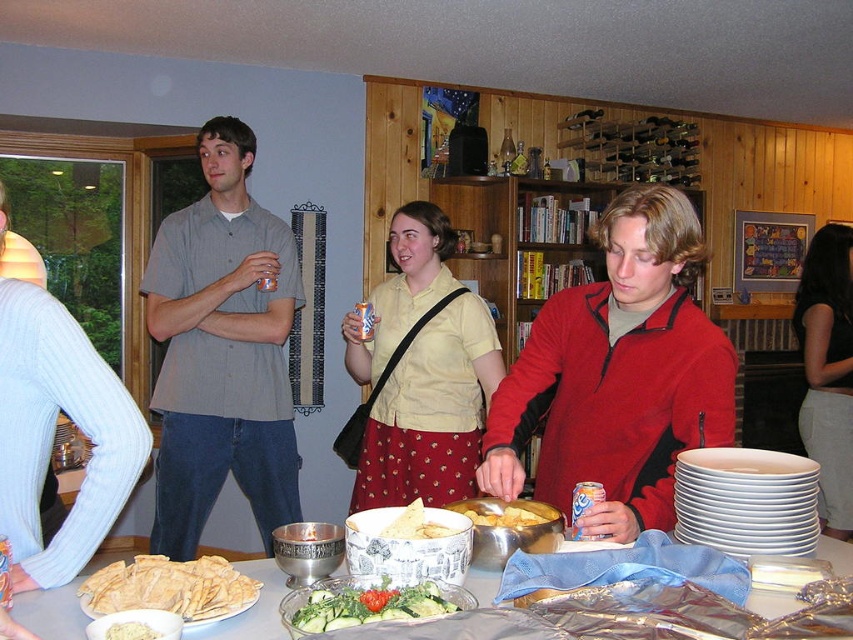
Between white ceramic plates at lower right and golden tortilla chips at center, which one is positioned higher?

Positioned higher is white ceramic plates at lower right.

Who is shorter, white ceramic plates at lower right or golden tortilla chips at center?

With less height is golden tortilla chips at center.

Is point (751, 515) in front of point (149, 568)?

That is False.

At what (x,y) coordinates should I click in order to perform the action: click on white ceramic plates at lower right. Please return your answer as a coordinate pair (x, y). The height and width of the screenshot is (640, 853). Looking at the image, I should click on (746, 500).

Is cable-knit sweater at left taller than green leafy salad at center?

Yes.

This screenshot has width=853, height=640. Describe the element at coordinates (53, 433) in the screenshot. I see `cable-knit sweater at left` at that location.

Is point (51, 324) farther from camera compared to point (357, 589)?

That is True.

Image resolution: width=853 pixels, height=640 pixels. In order to click on cable-knit sweater at left in this screenshot , I will do `click(53, 433)`.

Which is in front, point (735, 448) or point (541, 518)?

Point (541, 518) is in front.

Measure the distance between white ceramic plates at lower right and golden crispy chips at center.

They are 12.93 inches apart.

Which is in front, point (804, 465) or point (527, 524)?

Point (527, 524) is more forward.

This screenshot has height=640, width=853. Find the location of `white ceramic plates at lower right`. white ceramic plates at lower right is located at coordinates (746, 500).